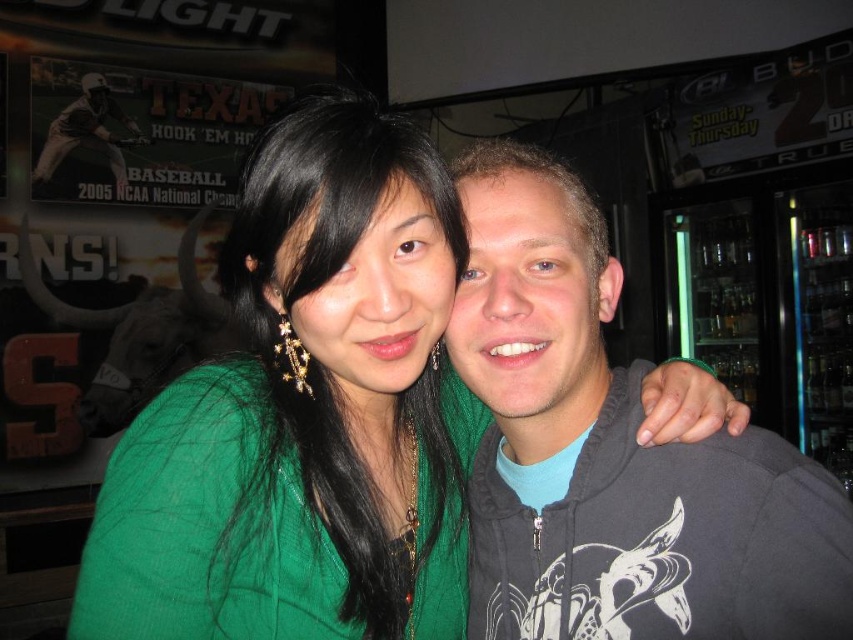
Question: Among these points, which one is farthest from the camera?

Choices:
 (A) (772, 618)
 (B) (312, 624)

Answer: (B)

Question: Can you confirm if green fabric at center is positioned to the left of dark gray hoodie at right?

Choices:
 (A) no
 (B) yes

Answer: (B)

Question: Is green fabric at center positioned behind dark gray hoodie at right?

Choices:
 (A) no
 (B) yes

Answer: (A)

Question: Which point is farther to the camera?

Choices:
 (A) green fabric at center
 (B) dark gray hoodie at right

Answer: (B)

Question: Is green fabric at center thinner than dark gray hoodie at right?

Choices:
 (A) no
 (B) yes

Answer: (A)